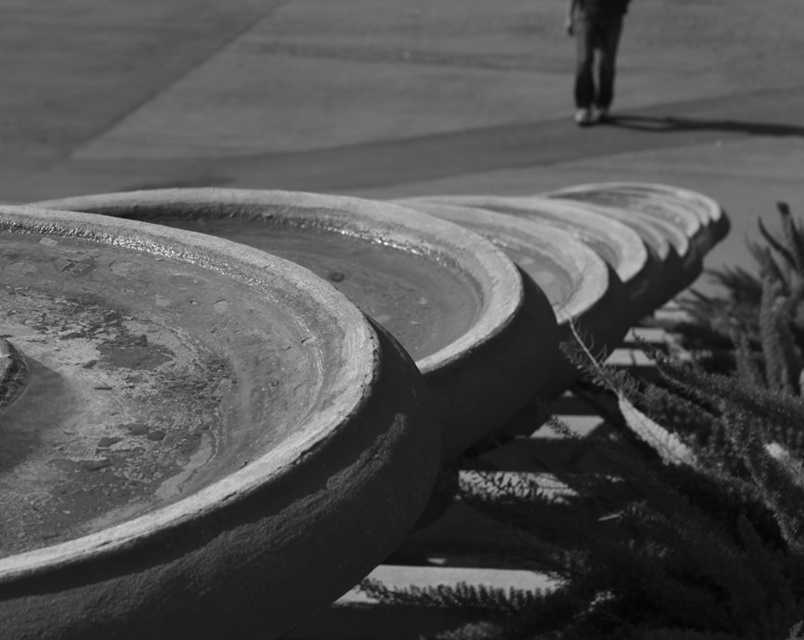
You are standing in front of the row of planters and notice the fuzzy green plant at center and the dark jeans at upper right. Which object is positioned more to the east if the sun is shining from the west?

The fuzzy green plant at center is to the left of dark jeans at upper right. Since the sun is coming from the west, shadows would fall to the east. The object casting a shadow towards the east would be the one further west. However, without specific shadow direction details, we can infer based on their positions. If the plant is to the left of the jeans, and assuming left is east, then the fuzzy green plant at center would be more to the east.

You are a gardener looking at the photograph of the planters. You notice a point marked at coordinates (663, 490). What is located at that point?

The point at coordinates (663, 490) marks a fuzzy green plant at center.

You are a gardener assessing the growth of plants in the planters. You notice the fuzzy green plant at center and dark jeans at upper right. Which of these is taller?

The fuzzy green plant at center is much taller than the dark jeans at upper right.